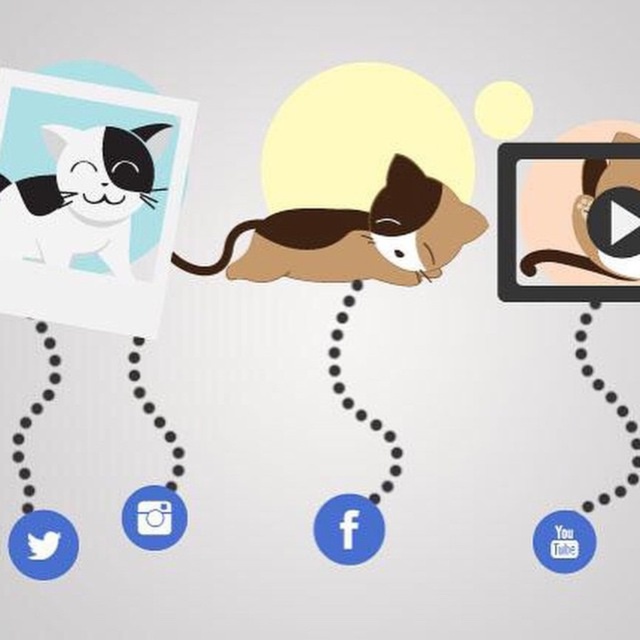
You are designing a social media post and want to highlight both the brown plush cat at center and the matte black cat at upper left. Given their sizes, which cat should you place in the foreground to draw more attention?

The brown plush cat at center should be placed in the foreground because it is larger than the matte black cat at upper left, making it more visually prominent.

You are designing a social media post and want to ensure all cat images are visible. Given that the brown plush cat at center is wider than the matte black cat at upper left, which cat should be placed closer to the edge to avoid overlapping with other elements?

The matte black cat at upper left should be placed closer to the edge since it is narrower than the brown plush cat at center, allowing more space for the wider cat in the center without overlapping.